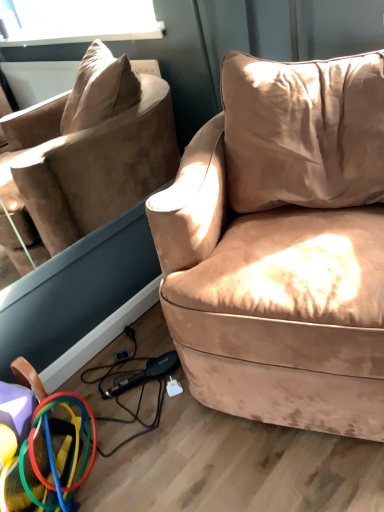
Image resolution: width=384 pixels, height=512 pixels. What are the coordinates of `suede-like beige couch at center-right` in the screenshot? It's located at (284, 247).

This screenshot has height=512, width=384. What do you see at coordinates (41, 444) in the screenshot?
I see `rubberized plastic rings at lower left` at bounding box center [41, 444].

Identify the location of suede-like beige couch at center-right. Image resolution: width=384 pixels, height=512 pixels. (284, 247).

How different are the orientations of rubberized plastic rings at lower left and beige velvet pillow at upper right in degrees?

rubberized plastic rings at lower left and beige velvet pillow at upper right are facing 89.9 degrees away from each other.

Can you confirm if rubberized plastic rings at lower left is smaller than beige velvet pillow at upper right?

Indeed, rubberized plastic rings at lower left has a smaller size compared to beige velvet pillow at upper right.

Between rubberized plastic rings at lower left and beige velvet pillow at upper right, which one appears on the left side from the viewer's perspective?

rubberized plastic rings at lower left.

Where is `toy in front of the beige velvet pillow at upper right`? toy in front of the beige velvet pillow at upper right is located at coordinates (41, 444).

Would you say beige velvet pillow at upper right is inside or outside suede-like beige couch at center-right?

beige velvet pillow at upper right is contained in suede-like beige couch at center-right.

Measure the distance between beige velvet pillow at upper right and suede-like beige couch at center-right.

A distance of 5.35 inches exists between beige velvet pillow at upper right and suede-like beige couch at center-right.

Is beige velvet pillow at upper right far from suede-like beige couch at center-right?

No, beige velvet pillow at upper right is not far away from suede-like beige couch at center-right.

You are a GUI agent. You are given a task and a screenshot of the screen. Output one action in this format:
    pyautogui.click(x=<x>, y=<y>)
    Task: Click on the studio couch on the left of beige velvet pillow at upper right
    The width and height of the screenshot is (384, 512).
    Given the screenshot: What is the action you would take?
    tap(284, 247)

Is suede-like beige couch at center-right shorter than beige velvet pillow at upper right?

No.

How distant is suede-like beige couch at center-right from beige velvet pillow at upper right?

A distance of 5.35 inches exists between suede-like beige couch at center-right and beige velvet pillow at upper right.

Considering the positions of objects suede-like beige couch at center-right and beige velvet pillow at upper right in the image provided, who is in front, suede-like beige couch at center-right or beige velvet pillow at upper right?

Positioned in front is suede-like beige couch at center-right.

In the scene shown: Looking at their sizes, would you say beige velvet pillow at upper right is wider or thinner than rubberized plastic rings at lower left?

Clearly, beige velvet pillow at upper right has more width compared to rubberized plastic rings at lower left.

Consider the image. Is the depth of beige velvet pillow at upper right less than that of rubberized plastic rings at lower left?

That is False.

From a real-world perspective, which object stands above the other?

beige velvet pillow at upper right, from a real-world perspective.

What's the angular difference between beige velvet pillow at upper right and rubberized plastic rings at lower left's facing directions?

The facing directions of beige velvet pillow at upper right and rubberized plastic rings at lower left are 89.9 degrees apart.

From the image's perspective, which is above, rubberized plastic rings at lower left or suede-like beige couch at center-right?

suede-like beige couch at center-right, from the image's perspective.

From the picture: Would you say suede-like beige couch at center-right is part of rubberized plastic rings at lower left's contents?

No, suede-like beige couch at center-right is not surrounded by rubberized plastic rings at lower left.

Image resolution: width=384 pixels, height=512 pixels. I want to click on studio couch above the rubberized plastic rings at lower left (from a real-world perspective), so click(284, 247).

Is rubberized plastic rings at lower left further to camera compared to suede-like beige couch at center-right?

Yes, rubberized plastic rings at lower left is behind suede-like beige couch at center-right.

Is suede-like beige couch at center-right not near rubberized plastic rings at lower left?

Actually, suede-like beige couch at center-right and rubberized plastic rings at lower left are a little close together.

What's the angular difference between suede-like beige couch at center-right and rubberized plastic rings at lower left's facing directions?

The facing directions of suede-like beige couch at center-right and rubberized plastic rings at lower left are 67.2 degrees apart.

Does suede-like beige couch at center-right contain rubberized plastic rings at lower left?

No, rubberized plastic rings at lower left is not surrounded by suede-like beige couch at center-right.

Is suede-like beige couch at center-right bigger than rubberized plastic rings at lower left?

Correct, suede-like beige couch at center-right is larger in size than rubberized plastic rings at lower left.

Image resolution: width=384 pixels, height=512 pixels. Find the location of `pillow behind the rubberized plastic rings at lower left`. pillow behind the rubberized plastic rings at lower left is located at coordinates click(x=303, y=131).

You are a GUI agent. You are given a task and a screenshot of the screen. Output one action in this format:
    pyautogui.click(x=<x>, y=<y>)
    Task: Click on the pillow on the right of suede-like beige couch at center-right
    The height and width of the screenshot is (512, 384).
    Given the screenshot: What is the action you would take?
    pyautogui.click(x=303, y=131)

Considering their positions, is beige velvet pillow at upper right positioned closer to suede-like beige couch at center-right than rubberized plastic rings at lower left?

beige velvet pillow at upper right is closer to suede-like beige couch at center-right.

Consider the image. When comparing their distances from rubberized plastic rings at lower left, does suede-like beige couch at center-right or beige velvet pillow at upper right seem closer?

suede-like beige couch at center-right.

Based on their spatial positions, is rubberized plastic rings at lower left or suede-like beige couch at center-right further from beige velvet pillow at upper right?

rubberized plastic rings at lower left is further to beige velvet pillow at upper right.

Considering their positions, is beige velvet pillow at upper right positioned closer to rubberized plastic rings at lower left than suede-like beige couch at center-right?

Among the two, suede-like beige couch at center-right is located nearer to rubberized plastic rings at lower left.

Which object lies nearer to the anchor point beige velvet pillow at upper right, suede-like beige couch at center-right or rubberized plastic rings at lower left?

Among the two, suede-like beige couch at center-right is located nearer to beige velvet pillow at upper right.

Estimate the real-world distances between objects in this image. Which object is further from suede-like beige couch at center-right, rubberized plastic rings at lower left or beige velvet pillow at upper right?

rubberized plastic rings at lower left.

Where is `studio couch between beige velvet pillow at upper right and rubberized plastic rings at lower left in the up-down direction`? Image resolution: width=384 pixels, height=512 pixels. studio couch between beige velvet pillow at upper right and rubberized plastic rings at lower left in the up-down direction is located at coordinates (284, 247).